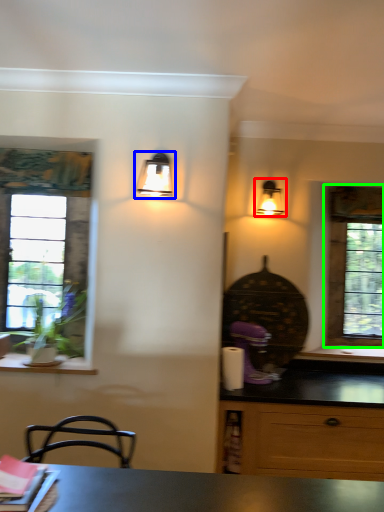
Question: Considering the real-world distances, which object is farthest from lamp (highlighted by a red box)? lamp (highlighted by a blue box) or window (highlighted by a green box)?

Choices:
 (A) lamp
 (B) window

Answer: (A)